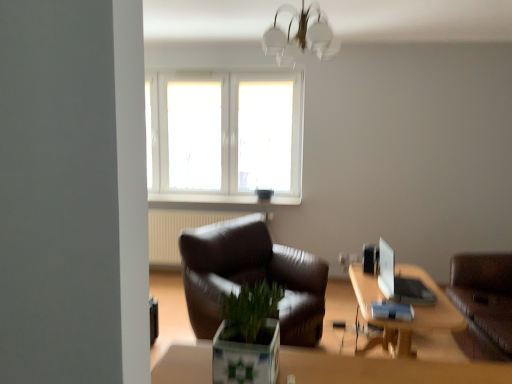
Question: Is the depth of green matte plant at center less than that of wooden table at lower right?

Choices:
 (A) no
 (B) yes

Answer: (B)

Question: From a real-world perspective, is green matte plant at center positioned under wooden table at lower right based on gravity?

Choices:
 (A) no
 (B) yes

Answer: (A)

Question: From a real-world perspective, is green matte plant at center on top of wooden table at lower right?

Choices:
 (A) yes
 (B) no

Answer: (A)

Question: From the image's perspective, does green matte plant at center appear lower than wooden table at lower right?

Choices:
 (A) no
 (B) yes

Answer: (A)

Question: Does green matte plant at center have a larger size compared to wooden table at lower right?

Choices:
 (A) no
 (B) yes

Answer: (A)

Question: Are green matte plant at center and wooden table at lower right beside each other?

Choices:
 (A) no
 (B) yes

Answer: (A)

Question: Is brown leather couch at right not close to white glossy monitor at upper right?

Choices:
 (A) no
 (B) yes

Answer: (A)

Question: Can you confirm if brown leather couch at right is smaller than white glossy monitor at upper right?

Choices:
 (A) no
 (B) yes

Answer: (A)

Question: Is brown leather couch at right to the right of white glossy monitor at upper right from the viewer's perspective?

Choices:
 (A) yes
 (B) no

Answer: (A)

Question: From a real-world perspective, is brown leather couch at right on white glossy monitor at upper right?

Choices:
 (A) yes
 (B) no

Answer: (B)

Question: From a real-world perspective, is brown leather couch at right located beneath white glossy monitor at upper right?

Choices:
 (A) no
 (B) yes

Answer: (B)

Question: Is brown leather couch at right to the left of white glossy monitor at upper right from the viewer's perspective?

Choices:
 (A) no
 (B) yes

Answer: (A)

Question: Is the position of brown leather couch at right more distant than that of green matte plant at center?

Choices:
 (A) no
 (B) yes

Answer: (B)